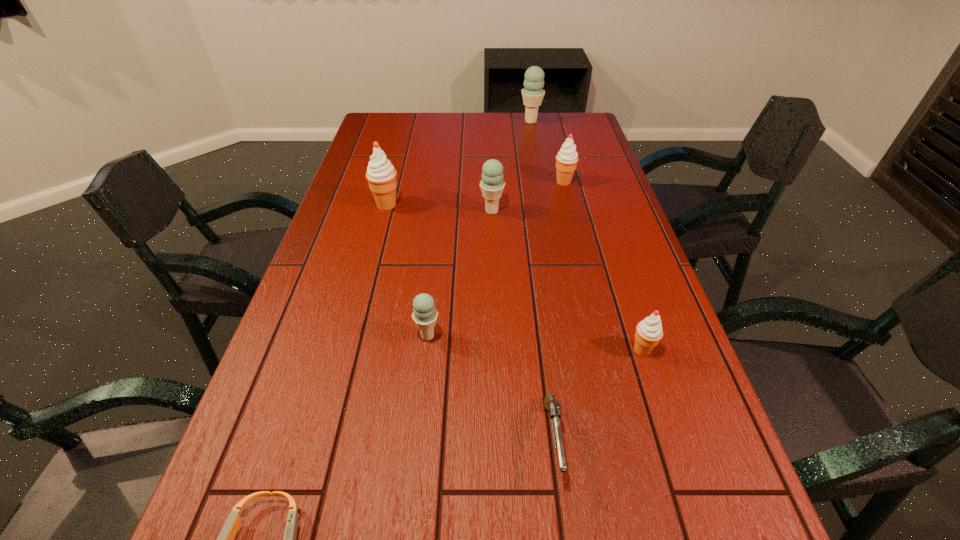
Find the location of a particular element. Image resolution: width=960 pixels, height=540 pixels. the farthest object is located at coordinates (533, 94).

At what (x,y) coordinates should I click in order to perform the action: click on the biggest blue ice cream. Please return your answer as a coordinate pair (x, y). Looking at the image, I should click on [533, 94].

Where is `the biggest red icecream`? the biggest red icecream is located at coordinates (381, 175).

You are a GUI agent. You are given a task and a screenshot of the screen. Output one action in this format:
    pyautogui.click(x=<x>, y=<y>)
    Task: Click on the second nearest red icecream
    
    Given the screenshot: What is the action you would take?
    pyautogui.click(x=381, y=175)

Identify the location of the second biggest red icecream. The width and height of the screenshot is (960, 540). (566, 160).

You are a GUI agent. You are given a task and a screenshot of the screen. Output one action in this format:
    pyautogui.click(x=<x>, y=<y>)
    Task: Click on the second red icecream from right to left
    
    Given the screenshot: What is the action you would take?
    pyautogui.click(x=566, y=160)

This screenshot has width=960, height=540. Find the location of `the second farthest blue ice cream`. the second farthest blue ice cream is located at coordinates (492, 184).

Locate an element on the screen. The image size is (960, 540). the second blue ice cream from left to right is located at coordinates (492, 184).

What are the coordinates of `the nearest red icecream` in the screenshot? It's located at (649, 332).

This screenshot has width=960, height=540. In order to click on the smallest red icecream in this screenshot , I will do `click(649, 332)`.